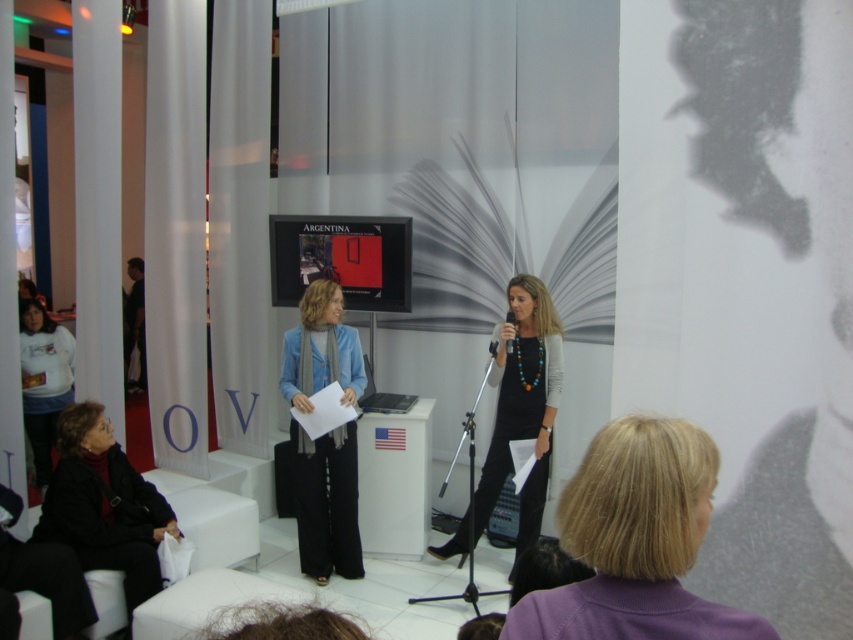
In order to click on blue woolen scarf at center in this screenshot , I will do `click(326, 500)`.

Can you confirm if blue woolen scarf at center is positioned below white matte shirt at left?

Indeed, blue woolen scarf at center is positioned under white matte shirt at left.

From the picture: Who is more forward, (x=306, y=307) or (x=48, y=378)?

Point (x=306, y=307) is more forward.

This screenshot has width=853, height=640. I want to click on blue woolen scarf at center, so click(x=326, y=500).

Can you confirm if black leather jacket at lower left is bigger than white matte shirt at left?

Yes.

Locate an element on the screen. The image size is (853, 640). black leather jacket at lower left is located at coordinates (103, 506).

Is point (102, 547) positioned in front of point (38, 340)?

Yes, point (102, 547) is in front of point (38, 340).

The height and width of the screenshot is (640, 853). Identify the location of black leather jacket at lower left. (103, 506).

Can you confirm if black glossy dress at center is bigger than black plastic microphone at center?

Indeed, black glossy dress at center has a larger size compared to black plastic microphone at center.

Is point (474, 528) closer to camera compared to point (494, 348)?

No.

In order to click on black glossy dress at center in this screenshot , I will do `click(518, 413)`.

Image resolution: width=853 pixels, height=640 pixels. What are the coordinates of `black glossy dress at center` in the screenshot? It's located at (518, 413).